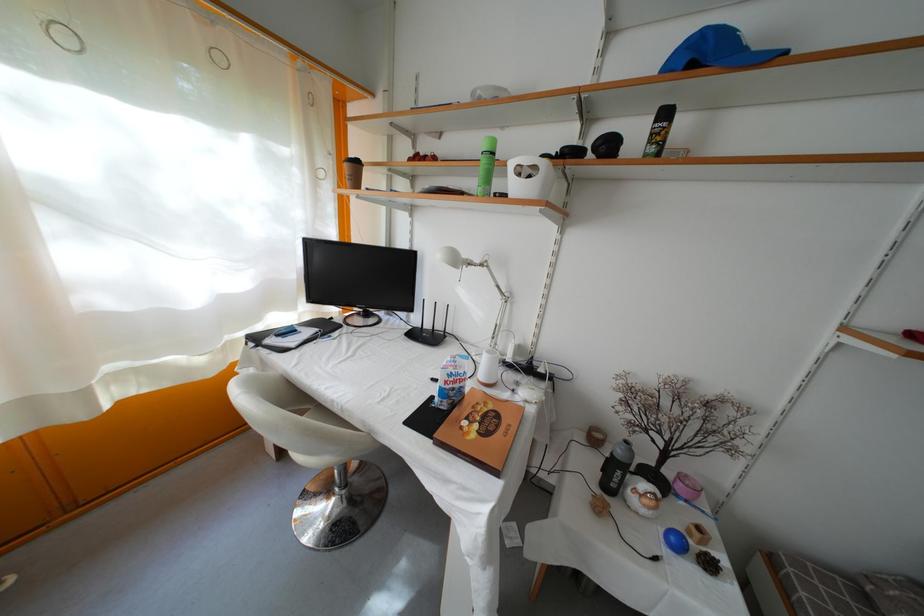
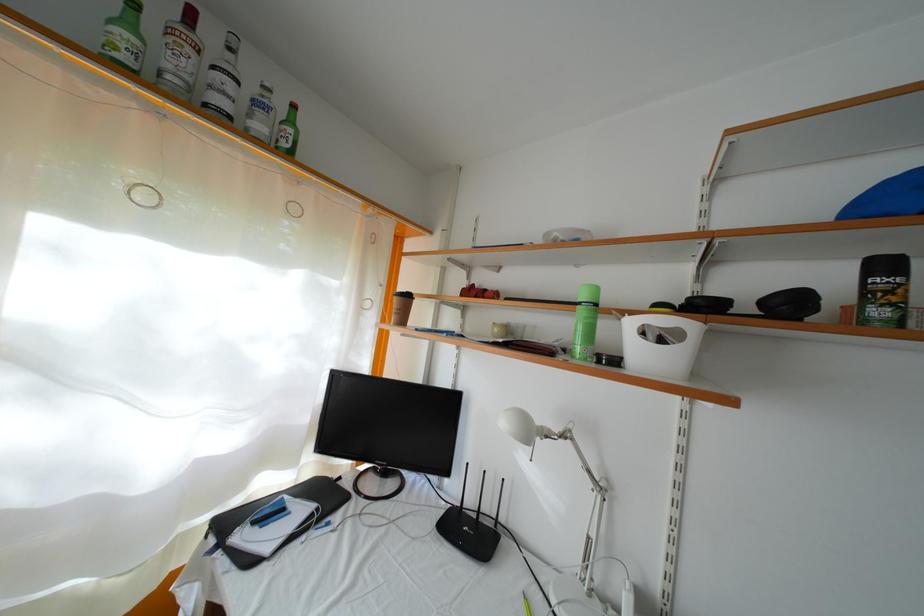
The images are taken continuously from a first-person perspective. In which direction are you moving?

The cameraman moved toward left, forward.